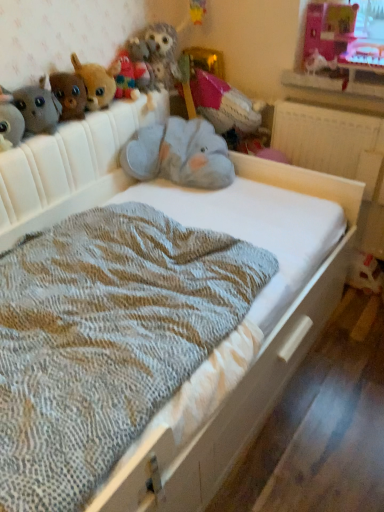
Question: From the image's perspective, does fuzzy fabric stuffed animal at upper left, which is the fifth toy from right to left, appear higher than white glossy bird at upper right, which appears as the first animal when viewed from the right?

Choices:
 (A) no
 (B) yes

Answer: (A)

Question: Is fuzzy fabric stuffed animal at upper left, which is the fifth toy from right to left, bigger than white glossy bird at upper right, which is counted as the 2th animal, starting from the left?

Choices:
 (A) yes
 (B) no

Answer: (A)

Question: From a real-world perspective, is fuzzy fabric stuffed animal at upper left, which is the fifth toy from right to left, on white glossy bird at upper right, which is counted as the 2th animal, starting from the left?

Choices:
 (A) no
 (B) yes

Answer: (B)

Question: Is fuzzy fabric stuffed animal at upper left, which is the fifth toy from right to left, positioned behind white glossy bird at upper right, which appears as the first animal when viewed from the right?

Choices:
 (A) no
 (B) yes

Answer: (A)

Question: Can you confirm if fuzzy fabric stuffed animal at upper left, marked as the 2th toy in a left-to-right arrangement, is positioned to the right of white glossy bird at upper right, which is counted as the 2th animal, starting from the left?

Choices:
 (A) no
 (B) yes

Answer: (A)

Question: Is fuzzy gray plush at upper left, which is the sixth toy from right to left, inside the boundaries of pink fabric stuffed animal at upper center, marked as the 1th toy in a right-to-left arrangement, or outside?

Choices:
 (A) inside
 (B) outside

Answer: (B)

Question: In terms of width, does fuzzy gray plush at upper left, the first toy positioned from the left, look wider or thinner when compared to pink fabric stuffed animal at upper center, which ranks as the sixth toy in left-to-right order?

Choices:
 (A) thin
 (B) wide

Answer: (A)

Question: Is point (0, 139) positioned closer to the camera than point (231, 89)?

Choices:
 (A) farther
 (B) closer

Answer: (B)

Question: From a real-world perspective, is fuzzy gray plush at upper left, the first toy positioned from the left, positioned above or below pink fabric stuffed animal at upper center, marked as the 1th toy in a right-to-left arrangement?

Choices:
 (A) below
 (B) above

Answer: (B)

Question: Is point (314, 61) positioned closer to the camera than point (67, 100)?

Choices:
 (A) farther
 (B) closer

Answer: (A)

Question: From the image's perspective, is white glossy bird at upper right, which is counted as the 2th animal, starting from the left, positioned above or below brown plush toy at upper left, which is the 4th toy in right-to-left order?

Choices:
 (A) above
 (B) below

Answer: (A)

Question: Would you say white glossy bird at upper right, which appears as the first animal when viewed from the right, is to the left or to the right of brown plush toy at upper left, which is the 4th toy in right-to-left order, in the picture?

Choices:
 (A) right
 (B) left

Answer: (A)

Question: Is white glossy bird at upper right, which appears as the first animal when viewed from the right, in front of or behind brown plush toy at upper left, which is the 4th toy in right-to-left order, in the image?

Choices:
 (A) front
 (B) behind

Answer: (B)

Question: In the image, is fuzzy fabric owl at upper center, which is the second animal in right-to-left order, positioned in front of or behind fuzzy gray plush at upper left, the first toy positioned from the left?

Choices:
 (A) front
 (B) behind

Answer: (B)

Question: Is fuzzy fabric owl at upper center, which is the second animal in right-to-left order, to the left or to the right of fuzzy gray plush at upper left, which is the sixth toy from right to left, in the image?

Choices:
 (A) left
 (B) right

Answer: (B)